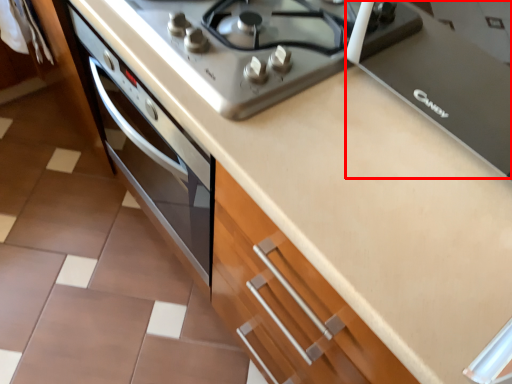
Question: From the image's perspective, considering the relative positions of appliance (annotated by the red box) and gas stove in the image provided, where is appliance (annotated by the red box) located with respect to the staircase?

Choices:
 (A) below
 (B) above

Answer: (A)